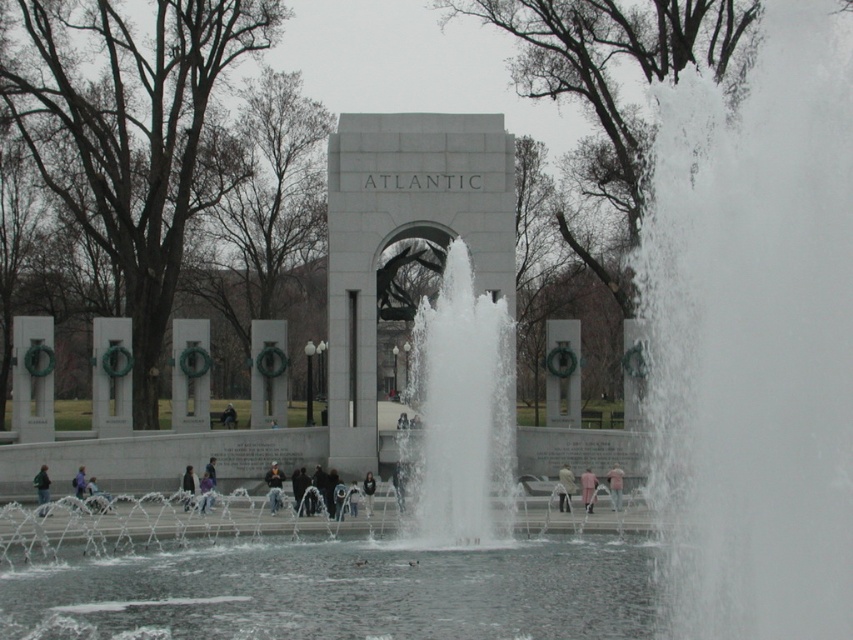
Question: From the image, what is the correct spatial relationship of light brown leather jacket at center in relation to pink fabric person at center?

Choices:
 (A) below
 (B) above

Answer: (A)

Question: Does light brown leather jacket at center have a lesser width compared to dark gray jacket at center?

Choices:
 (A) yes
 (B) no

Answer: (B)

Question: Which of the following is the closest to the observer?

Choices:
 (A) pink fabric coat at center
 (B) dark gray jacket at center

Answer: (B)

Question: Considering the real-world distances, which object is closest to the pink fabric coat at center?

Choices:
 (A) dark blue jeans at center
 (B) light brown leather jacket at center

Answer: (B)

Question: Which object is positioned farthest from the light blue fabric jacket at lower left?

Choices:
 (A) pink fabric at center
 (B) dark blue jeans at lower left
 (C) light brown leather jacket at center
 (D) dark blue jeans at center

Answer: (A)

Question: From the image, what is the correct spatial relationship of dark blue jeans at lower left in relation to dark gray jacket at center?

Choices:
 (A) right
 (B) left

Answer: (B)